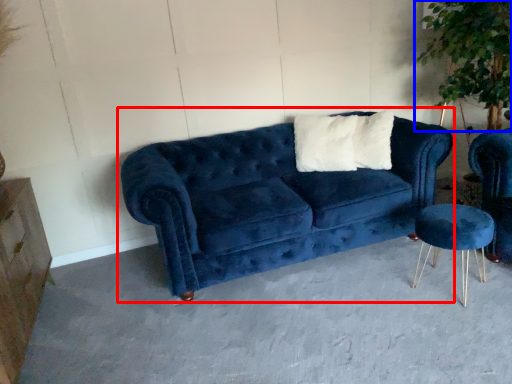
Question: Which object is further to the camera taking this photo, studio couch (highlighted by a red box) or plant (highlighted by a blue box)?

Choices:
 (A) studio couch
 (B) plant

Answer: (B)